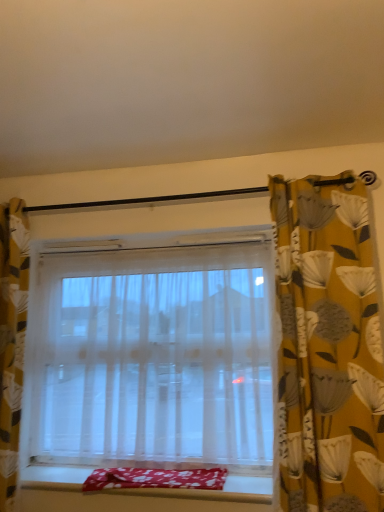
What do you see at coordinates (328, 347) in the screenshot?
I see `yellow floral fabric curtain at right, the 2th curtain when ordered from left to right` at bounding box center [328, 347].

Measure the distance between yellow floral fabric curtain at right, the 2th curtain when ordered from left to right, and camera.

yellow floral fabric curtain at right, the 2th curtain when ordered from left to right, and camera are 4.27 feet apart.

At what (x,y) coordinates should I click in order to perform the action: click on transparent fabric window at center. Please return your answer as a coordinate pair (x, y). The height and width of the screenshot is (512, 384). Looking at the image, I should click on [x=154, y=357].

From the image's perspective, between floral cotton blanket at lower center and smooth fabric window sill at lower center, who is located below?

smooth fabric window sill at lower center appears lower in the image.

Could you tell me if floral cotton blanket at lower center is facing smooth fabric window sill at lower center?

Yes, floral cotton blanket at lower center is aimed at smooth fabric window sill at lower center.

In terms of size, does floral cotton blanket at lower center appear bigger or smaller than smooth fabric window sill at lower center?

Considering their sizes, floral cotton blanket at lower center takes up more space than smooth fabric window sill at lower center.

Considering the sizes of floral cotton blanket at lower center and smooth fabric window sill at lower center in the image, is floral cotton blanket at lower center wider or thinner than smooth fabric window sill at lower center?

Considering their sizes, floral cotton blanket at lower center looks slimmer than smooth fabric window sill at lower center.

Is smooth fabric window sill at lower center at the left side of yellow floral fabric curtain at left, which is the first curtain from left to right?

No.

Where is `window sill that is under the yellow floral fabric curtain at left, marked as the second curtain in a right-to-left arrangement (from a real-world perspective)`? window sill that is under the yellow floral fabric curtain at left, marked as the second curtain in a right-to-left arrangement (from a real-world perspective) is located at coordinates (214, 490).

Which of these two, smooth fabric window sill at lower center or yellow floral fabric curtain at left, marked as the second curtain in a right-to-left arrangement, is bigger?

yellow floral fabric curtain at left, marked as the second curtain in a right-to-left arrangement, is bigger.

Is transparent fabric window at center directly adjacent to floral cotton blanket at lower center?

There is a gap between transparent fabric window at center and floral cotton blanket at lower center.

Which is more to the right, transparent fabric window at center or floral cotton blanket at lower center?

From the viewer's perspective, floral cotton blanket at lower center appears more on the right side.

From the image's perspective, is transparent fabric window at center over floral cotton blanket at lower center?

Indeed, from the image's perspective, transparent fabric window at center is shown above floral cotton blanket at lower center.

Considering the relative sizes of transparent fabric window at center and floral cotton blanket at lower center in the image provided, is transparent fabric window at center smaller than floral cotton blanket at lower center?

No.

Measure the distance from floral cotton blanket at lower center to transparent fabric window at center.

floral cotton blanket at lower center is 15.95 inches from transparent fabric window at center.

Is floral cotton blanket at lower center positioned before transparent fabric window at center?

Yes, it is.

Can you confirm if floral cotton blanket at lower center is positioned to the left of transparent fabric window at center?

No.

Is floral cotton blanket at lower center next to transparent fabric window at center and touching it?

There is a gap between floral cotton blanket at lower center and transparent fabric window at center.

Is yellow floral fabric curtain at left, which is the first curtain from left to right, a part of floral cotton blanket at lower center?

That's incorrect, yellow floral fabric curtain at left, which is the first curtain from left to right, is not inside floral cotton blanket at lower center.

Is floral cotton blanket at lower center oriented towards yellow floral fabric curtain at left, marked as the second curtain in a right-to-left arrangement?

No, floral cotton blanket at lower center is not turned towards yellow floral fabric curtain at left, marked as the second curtain in a right-to-left arrangement.

Considering the positions of objects floral cotton blanket at lower center and yellow floral fabric curtain at left, marked as the second curtain in a right-to-left arrangement, in the image provided, who is more to the left, floral cotton blanket at lower center or yellow floral fabric curtain at left, marked as the second curtain in a right-to-left arrangement,?

Positioned to the left is yellow floral fabric curtain at left, marked as the second curtain in a right-to-left arrangement.

Who is shorter, floral cotton blanket at lower center or yellow floral fabric curtain at left, which is the first curtain from left to right?

Standing shorter between the two is floral cotton blanket at lower center.

Which of these two, yellow floral fabric curtain at left, marked as the second curtain in a right-to-left arrangement, or smooth fabric window sill at lower center, is smaller?

With smaller size is smooth fabric window sill at lower center.

Which object is further away from the camera taking this photo, yellow floral fabric curtain at left, which is the first curtain from left to right, or smooth fabric window sill at lower center?

yellow floral fabric curtain at left, which is the first curtain from left to right, is more distant.

Considering the relative sizes of yellow floral fabric curtain at left, marked as the second curtain in a right-to-left arrangement, and smooth fabric window sill at lower center in the image provided, is yellow floral fabric curtain at left, marked as the second curtain in a right-to-left arrangement, thinner than smooth fabric window sill at lower center?

Yes, yellow floral fabric curtain at left, marked as the second curtain in a right-to-left arrangement, is thinner than smooth fabric window sill at lower center.

Can you confirm if yellow floral fabric curtain at right, the 2th curtain when ordered from left to right, is positioned to the right of floral cotton blanket at lower center?

Yes.

Is yellow floral fabric curtain at right, the 2th curtain when ordered from left to right, touching floral cotton blanket at lower center?

No, yellow floral fabric curtain at right, the 2th curtain when ordered from left to right, is not making contact with floral cotton blanket at lower center.

In the scene shown: Could you measure the distance between yellow floral fabric curtain at right, the 2th curtain when ordered from left to right, and floral cotton blanket at lower center?

yellow floral fabric curtain at right, the 2th curtain when ordered from left to right, and floral cotton blanket at lower center are 64.20 centimeters apart from each other.

From the image's perspective, is yellow floral fabric curtain at right, the 2th curtain when ordered from left to right, above floral cotton blanket at lower center?

Yes.

There is a smooth fabric window sill at lower center. Where is `blanket above it (from a real-world perspective)`? The image size is (384, 512). blanket above it (from a real-world perspective) is located at coordinates (156, 478).

Locate an element on the screen. This screenshot has height=512, width=384. window sill below the yellow floral fabric curtain at left, which is the first curtain from left to right (from a real-world perspective) is located at coordinates (214, 490).

Based on their spatial positions, is yellow floral fabric curtain at right, the first curtain in the right-to-left sequence, or floral cotton blanket at lower center closer to smooth fabric window sill at lower center?

floral cotton blanket at lower center lies closer to smooth fabric window sill at lower center than the other object.

Considering their positions, is smooth fabric window sill at lower center positioned closer to floral cotton blanket at lower center than yellow floral fabric curtain at left, marked as the second curtain in a right-to-left arrangement?

smooth fabric window sill at lower center.

Estimate the real-world distances between objects in this image. Which object is further from floral cotton blanket at lower center, smooth fabric window sill at lower center or yellow floral fabric curtain at right, the 2th curtain when ordered from left to right?

The object further to floral cotton blanket at lower center is yellow floral fabric curtain at right, the 2th curtain when ordered from left to right.

Which object lies nearer to the anchor point transparent fabric window at center, yellow floral fabric curtain at right, the 2th curtain when ordered from left to right, or smooth fabric window sill at lower center?

Among the two, smooth fabric window sill at lower center is located nearer to transparent fabric window at center.

Estimate the real-world distances between objects in this image. Which object is further from transparent fabric window at center, yellow floral fabric curtain at right, the 2th curtain when ordered from left to right, or yellow floral fabric curtain at left, which is the first curtain from left to right?

Based on the image, yellow floral fabric curtain at right, the 2th curtain when ordered from left to right, appears to be further to transparent fabric window at center.

Considering their positions, is floral cotton blanket at lower center positioned closer to yellow floral fabric curtain at right, the first curtain in the right-to-left sequence, than transparent fabric window at center?

The object closer to yellow floral fabric curtain at right, the first curtain in the right-to-left sequence, is transparent fabric window at center.

From the image, which object appears to be nearer to floral cotton blanket at lower center, yellow floral fabric curtain at right, the 2th curtain when ordered from left to right, or yellow floral fabric curtain at left, marked as the second curtain in a right-to-left arrangement?

Based on the image, yellow floral fabric curtain at left, marked as the second curtain in a right-to-left arrangement, appears to be nearer to floral cotton blanket at lower center.

Based on their spatial positions, is floral cotton blanket at lower center or transparent fabric window at center closer to yellow floral fabric curtain at left, marked as the second curtain in a right-to-left arrangement?

transparent fabric window at center lies closer to yellow floral fabric curtain at left, marked as the second curtain in a right-to-left arrangement, than the other object.

This screenshot has height=512, width=384. I want to click on window between yellow floral fabric curtain at left, which is the first curtain from left to right, and floral cotton blanket at lower center, so click(154, 357).

The image size is (384, 512). Identify the location of blanket between transparent fabric window at center and smooth fabric window sill at lower center vertically. pyautogui.click(x=156, y=478).

Where is `window sill between yellow floral fabric curtain at left, marked as the second curtain in a right-to-left arrangement, and yellow floral fabric curtain at right, the first curtain in the right-to-left sequence, in the horizontal direction`? This screenshot has width=384, height=512. window sill between yellow floral fabric curtain at left, marked as the second curtain in a right-to-left arrangement, and yellow floral fabric curtain at right, the first curtain in the right-to-left sequence, in the horizontal direction is located at coordinates point(214,490).

The width and height of the screenshot is (384, 512). I want to click on window sill located between transparent fabric window at center and yellow floral fabric curtain at right, the 2th curtain when ordered from left to right, in the left-right direction, so click(214, 490).